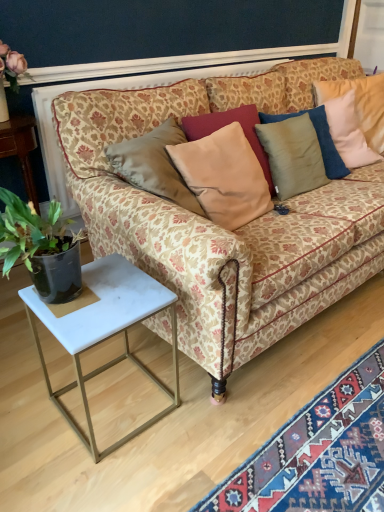
Where is `carpet with intricate patterns at lower right`? Image resolution: width=384 pixels, height=512 pixels. carpet with intricate patterns at lower right is located at coordinates (318, 452).

Consider the image. In order to face satin beige pillow at center, should I rotate leftwards or rightwards?

Rotate your view right by about 4.853°.

What do you see at coordinates (224, 176) in the screenshot?
I see `satin beige pillow at center` at bounding box center [224, 176].

The image size is (384, 512). I want to click on white marble side table at lower left, so click(x=105, y=332).

In order to face green leafy plant at left, should I rotate leftwards or rightwards?

To align with it, rotate left about 22.828°.

Find the location of a particular element. The image size is (384, 512). green leafy plant at left is located at coordinates (41, 248).

What are the coordinates of `carpet with intricate patterns at lower right` in the screenshot? It's located at (318, 452).

From a real-world perspective, who is located higher, carpet with intricate patterns at lower right or white marble side table at lower left?

white marble side table at lower left, from a real-world perspective.

Which point is more forward, (275, 504) or (161, 284)?

The point (275, 504) is in front.

Does carpet with intricate patterns at lower right have a lesser width compared to white marble side table at lower left?

Correct, the width of carpet with intricate patterns at lower right is less than that of white marble side table at lower left.

Between carpet with intricate patterns at lower right and white marble side table at lower left, which one is positioned in front?

carpet with intricate patterns at lower right is in front.

You are a GUI agent. You are given a task and a screenshot of the screen. Output one action in this format:
    pyautogui.click(x=<x>, y=<y>)
    Task: Click on the pillow in front of the green leafy plant at left
    
    Given the screenshot: What is the action you would take?
    pyautogui.click(x=224, y=176)

From the image's perspective, between satin beige pillow at center and green leafy plant at left, who is located below?

green leafy plant at left appears lower in the image.

Which of these two, satin beige pillow at center or green leafy plant at left, is smaller?

With smaller size is satin beige pillow at center.

Is satin beige pillow at center closer to camera compared to green leafy plant at left?

Yes.

Is satin beige pillow at center smaller than carpet with intricate patterns at lower right?

No, satin beige pillow at center is not smaller than carpet with intricate patterns at lower right.

From a real-world perspective, is satin beige pillow at center on carpet with intricate patterns at lower right?

Yes, from a real-world perspective, satin beige pillow at center is over carpet with intricate patterns at lower right

Does point (230, 208) come behind point (337, 503)?

Yes, point (230, 208) is farther from viewer.

What's the angular difference between satin beige pillow at center and carpet with intricate patterns at lower right's facing directions?

They differ by 178 degrees in their facing directions.

From the image's perspective, is white marble side table at lower left on top of carpet with intricate patterns at lower right?

Correct, white marble side table at lower left appears higher than carpet with intricate patterns at lower right in the image.

Considering the relative positions of white marble side table at lower left and carpet with intricate patterns at lower right in the image provided, is white marble side table at lower left to the left or to the right of carpet with intricate patterns at lower right?

In the image, white marble side table at lower left appears on the left side of carpet with intricate patterns at lower right.

Is white marble side table at lower left completely or partially outside of carpet with intricate patterns at lower right?

Yes, white marble side table at lower left is located beyond the bounds of carpet with intricate patterns at lower right.

In the scene shown: Considering the relative positions of white marble side table at lower left and green leafy plant at left in the image provided, is white marble side table at lower left in front of green leafy plant at left?

Yes, it is in front of green leafy plant at left.

In the image, is white marble side table at lower left on the left side or the right side of green leafy plant at left?

Based on their positions, white marble side table at lower left is located to the right of green leafy plant at left.

Is white marble side table at lower left oriented towards green leafy plant at left?

No, white marble side table at lower left does not turn towards green leafy plant at left.

Measure the distance between white marble side table at lower left and green leafy plant at left.

white marble side table at lower left is 8.89 inches away from green leafy plant at left.

Can you confirm if satin beige pillow at center is bigger than white marble side table at lower left?

Incorrect, satin beige pillow at center is not larger than white marble side table at lower left.

Between satin beige pillow at center and white marble side table at lower left, which one has more height?

satin beige pillow at center.

Considering the positions of points (232, 170) and (98, 325), is point (232, 170) farther from camera compared to point (98, 325)?

Yes, point (232, 170) is farther from viewer.

Consider the image. Is white marble side table at lower left inside satin beige pillow at center?

No, white marble side table at lower left is not inside satin beige pillow at center.

I want to click on mat in front of the green leafy plant at left, so click(318, 452).

Between point (59, 230) and point (309, 419), which one is positioned in front?

The point (59, 230) is closer.

Is green leafy plant at left positioned with its back to carpet with intricate patterns at lower right?

green leafy plant at left does not have its back to carpet with intricate patterns at lower right.

Where is `mat located below the white marble side table at lower left (from the image's perspective)`? The image size is (384, 512). mat located below the white marble side table at lower left (from the image's perspective) is located at coordinates (318, 452).

You are a GUI agent. You are given a task and a screenshot of the screen. Output one action in this format:
    pyautogui.click(x=<x>, y=<y>)
    Task: Click on the pillow located above the green leafy plant at left (from the image's perspective)
    
    Given the screenshot: What is the action you would take?
    pyautogui.click(x=224, y=176)

Estimate the real-world distances between objects in this image. Which object is closer to satin beige pillow at center, green leafy plant at left or white marble side table at lower left?

Based on the image, white marble side table at lower left appears to be nearer to satin beige pillow at center.

Estimate the real-world distances between objects in this image. Which object is further from satin beige pillow at center, green leafy plant at left or patterned fabric couch at center?

green leafy plant at left.

Estimate the real-world distances between objects in this image. Which object is closer to satin beige pillow at center, white marble side table at lower left or patterned fabric couch at center?

patterned fabric couch at center is positioned closer to the anchor satin beige pillow at center.

When comparing their distances from white marble side table at lower left, does patterned fabric couch at center or satin beige pillow at center seem closer?

patterned fabric couch at center lies closer to white marble side table at lower left than the other object.

Looking at the image, which one is located further to patterned fabric couch at center, carpet with intricate patterns at lower right or white marble side table at lower left?

carpet with intricate patterns at lower right is positioned further to the anchor patterned fabric couch at center.

When comparing their distances from green leafy plant at left, does patterned fabric couch at center or satin beige pillow at center seem closer?

Based on the image, patterned fabric couch at center appears to be nearer to green leafy plant at left.

Looking at the image, which one is located closer to satin beige pillow at center, carpet with intricate patterns at lower right or white marble side table at lower left?

white marble side table at lower left lies closer to satin beige pillow at center than the other object.

When comparing their distances from satin beige pillow at center, does white marble side table at lower left or carpet with intricate patterns at lower right seem closer?

white marble side table at lower left lies closer to satin beige pillow at center than the other object.

You are a GUI agent. You are given a task and a screenshot of the screen. Output one action in this format:
    pyautogui.click(x=<x>, y=<y>)
    Task: Click on the pillow that lies between patterned fabric couch at center and white marble side table at lower left from top to bottom
    The height and width of the screenshot is (512, 384).
    Given the screenshot: What is the action you would take?
    pyautogui.click(x=224, y=176)

This screenshot has height=512, width=384. I want to click on mat situated between green leafy plant at left and patterned fabric couch at center from left to right, so click(318, 452).

You are a GUI agent. You are given a task and a screenshot of the screen. Output one action in this format:
    pyautogui.click(x=<x>, y=<y>)
    Task: Click on the table between patterned fabric couch at center and carpet with intricate patterns at lower right in the vertical direction
    This screenshot has height=512, width=384.
    Given the screenshot: What is the action you would take?
    pyautogui.click(x=105, y=332)

Identify the location of table located between green leafy plant at left and patterned fabric couch at center in the left-right direction. click(x=105, y=332).